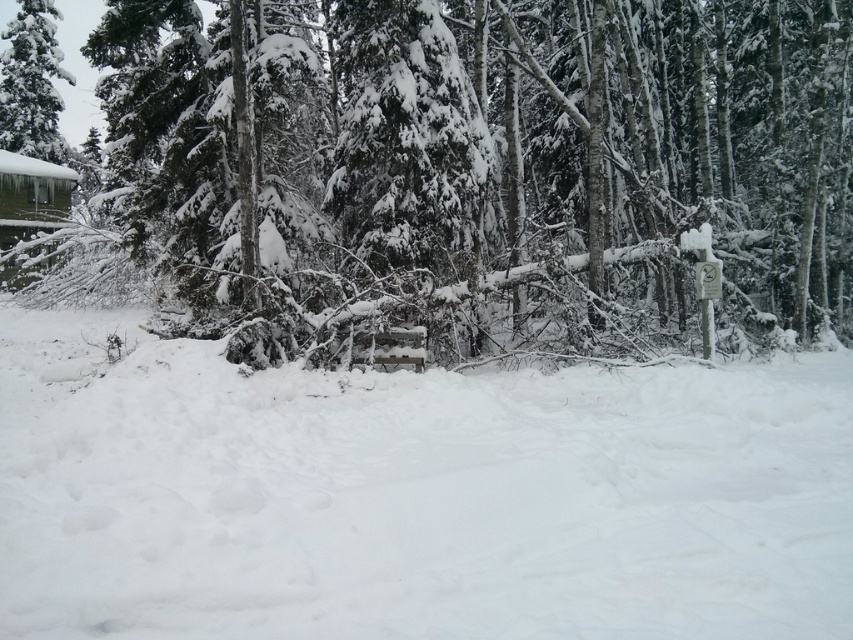
Question: Among these points, which one is nearest to the camera?

Choices:
 (A) (773, 554)
 (B) (42, 93)
 (C) (134, 56)

Answer: (A)

Question: Is snow-covered evergreen at center bigger than white fluffy snow at center?

Choices:
 (A) yes
 (B) no

Answer: (A)

Question: Does snow-covered evergreen at center have a greater width compared to snow-covered evergreen tree at upper left?

Choices:
 (A) no
 (B) yes

Answer: (B)

Question: Can you confirm if white fluffy snow at center is wider than snow-covered evergreen tree at upper left?

Choices:
 (A) yes
 (B) no

Answer: (A)

Question: Which is nearer to the snow-covered evergreen tree at upper left?

Choices:
 (A) snow-covered evergreen at center
 (B) white fluffy snow at center

Answer: (A)

Question: Which of the following is the closest to the observer?

Choices:
 (A) snow-covered evergreen tree at upper left
 (B) white fluffy snow at center

Answer: (B)